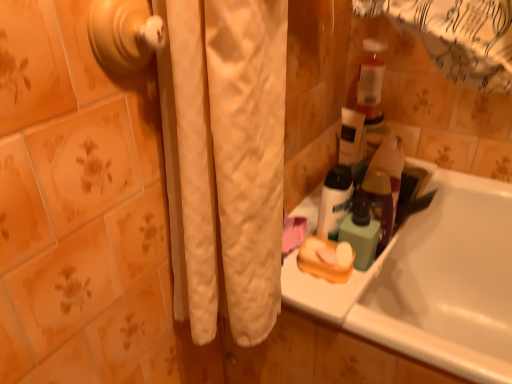
Locate an element on the screen. free space in front of orange matte soap dish at center is located at coordinates (346, 306).